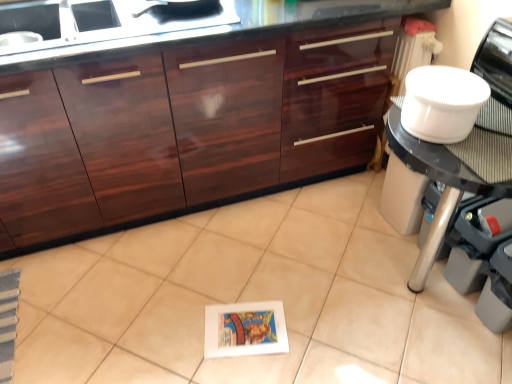
I want to click on free space that is to the left of white paper book at center, so click(x=182, y=327).